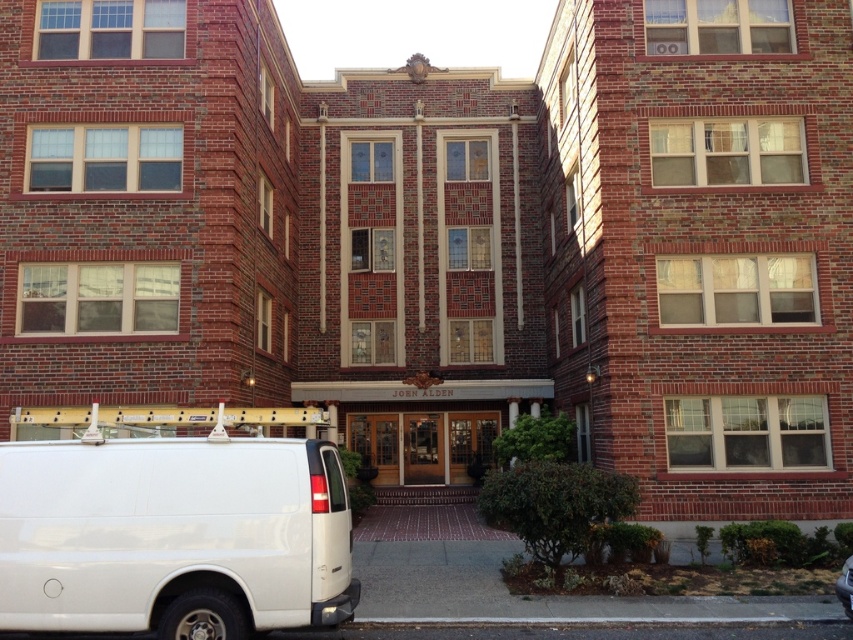
Is white matte van at lower left taller than shiny black car at lower right?

Yes, white matte van at lower left is taller than shiny black car at lower right.

Does white matte van at lower left appear on the left side of shiny black car at lower right?

Yes, white matte van at lower left is to the left of shiny black car at lower right.

Is point (105, 552) behind point (851, 570)?

No, (105, 552) is closer to viewer.

In order to click on white matte van at lower left in this screenshot , I will do `click(173, 534)`.